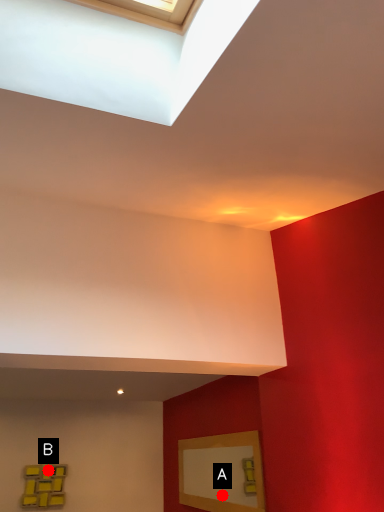
Question: Two points are circled on the image, labeled by A and B beside each circle. Which point is farther from the camera taking this photo?

Choices:
 (A) A is further
 (B) B is further

Answer: (A)